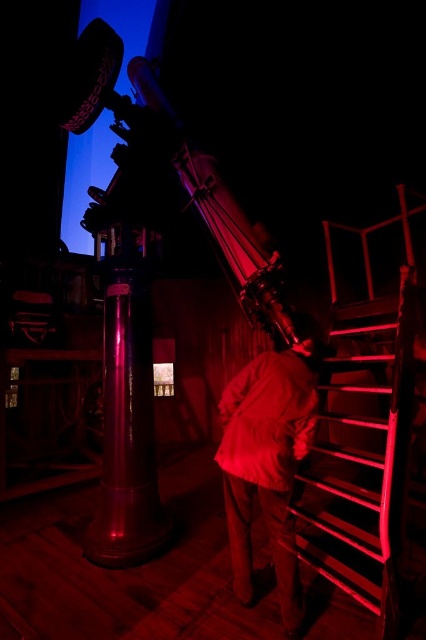
You are an astronomer preparing to adjust the telescope. You need to move from the metallic staircase at right to the matte white shirt at center. Which object is larger in size?

The metallic staircase at right is bigger than the matte white shirt at center.

You are standing at the center of the observatory and need to reach the control panel located at the top of the telescope. There is a point marked at coordinate point (362, 460). What object at that coordinate can help you ascend to the telescope?

The point at coordinate (362, 460) indicates the metallic staircase at right, which you can use to ascend to the telescope.

You are standing in the observatory and see two points marked on the telescope. The first point is at coordinate point (x=368, y=307) and the second point is at coordinate point (x=250, y=392). Which point is closer to you?

Point (x=250, y=392) is closer to you because it is less further to the camera than point (x=368, y=307).